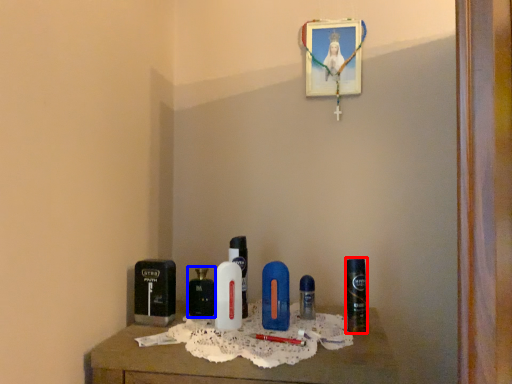
Question: Which object is closer to the camera taking this photo, personal care (highlighted by a red box) or perfume (highlighted by a blue box)?

Choices:
 (A) personal care
 (B) perfume

Answer: (A)